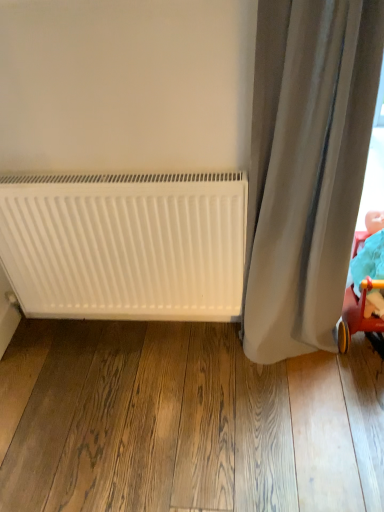
Find the location of a particular element. The width and height of the screenshot is (384, 512). vacant space situated on the left part of gray fabric curtain at right is located at coordinates (216, 369).